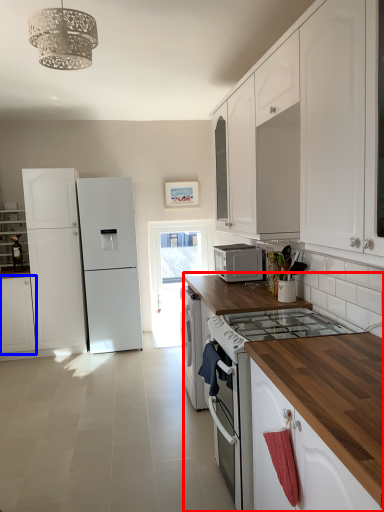
Question: Among these objects, which one is nearest to the camera, countertop (highlighted by a red box) or cabinetry (highlighted by a blue box)?

Choices:
 (A) countertop
 (B) cabinetry

Answer: (A)